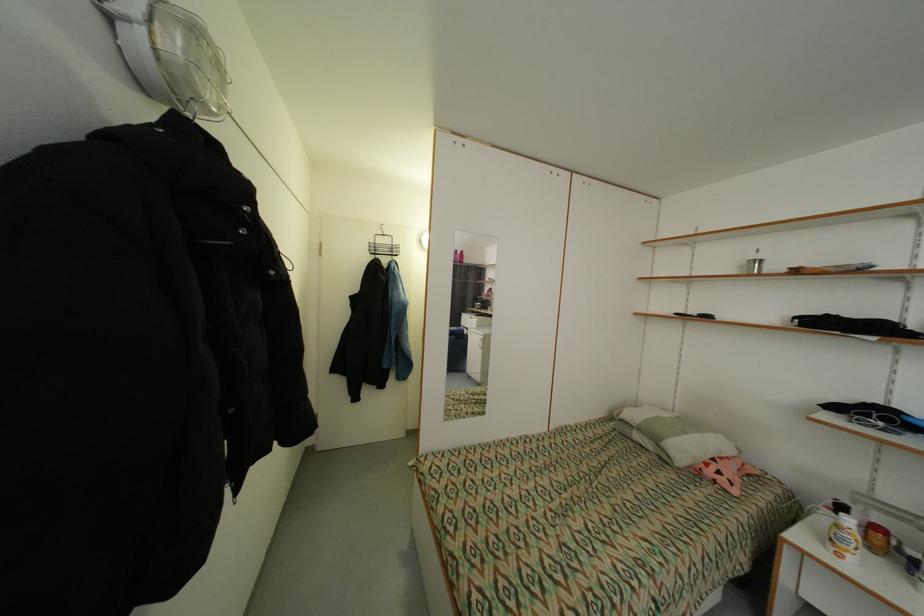
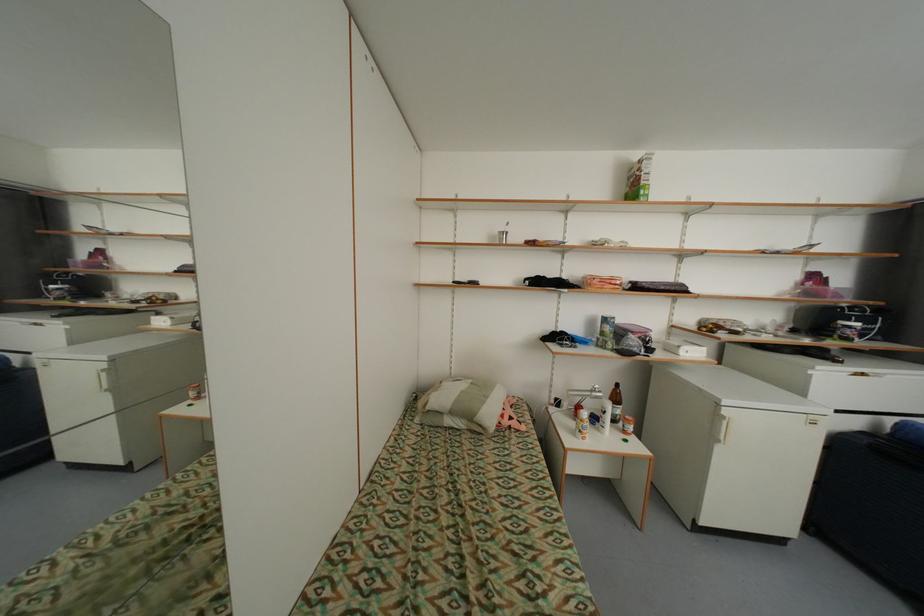
Question: How did the camera likely rotate?

Choices:
 (A) Left
 (B) Right
 (C) Up
 (D) Down

Answer: (B)